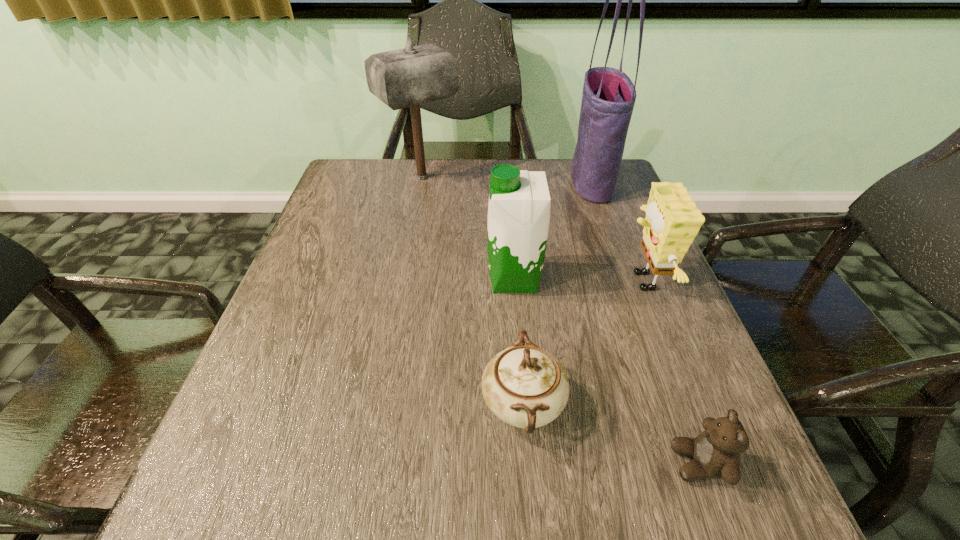
Find the location of `vacant space at the near edge of the desktop`. vacant space at the near edge of the desktop is located at coordinates (459, 501).

I want to click on vacant space at the left edge, so (x=235, y=400).

You are a GUI agent. You are given a task and a screenshot of the screen. Output one action in this format:
    pyautogui.click(x=<x>, y=<y>)
    Task: Click on the vacant space at the right edge of the desktop
    
    Given the screenshot: What is the action you would take?
    pyautogui.click(x=607, y=234)

In the image, there is a desktop. Where is `free space at the far left corner`? This screenshot has width=960, height=540. free space at the far left corner is located at coordinates [378, 180].

The image size is (960, 540). I want to click on empty location between the sponge and the chinaware, so click(x=582, y=343).

Locate an element on the screen. This screenshot has height=540, width=960. vacant space that's between the fourth tallest object and the chinaware is located at coordinates (582, 343).

Where is `free space between the chinaware and the tote bag`? This screenshot has width=960, height=540. free space between the chinaware and the tote bag is located at coordinates (557, 293).

You are a GUI agent. You are given a task and a screenshot of the screen. Output one action in this format:
    pyautogui.click(x=<x>, y=<y>)
    Task: Click on the empty location between the chinaware and the sponge
    Image resolution: width=960 pixels, height=540 pixels.
    Given the screenshot: What is the action you would take?
    pyautogui.click(x=582, y=343)

Image resolution: width=960 pixels, height=540 pixels. In order to click on free point between the third shortest object and the tote bag in this screenshot , I will do `click(616, 231)`.

What are the coordinates of `free space that is in between the mallet and the chinaware` in the screenshot? It's located at (472, 291).